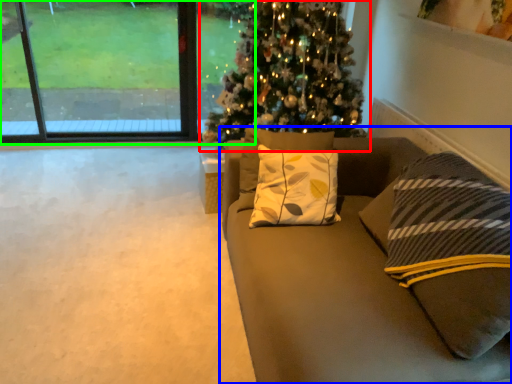
Question: Considering the real-world distances, which object is farthest from christmas tree (highlighted by a red box)? studio couch (highlighted by a blue box) or window (highlighted by a green box)?

Choices:
 (A) studio couch
 (B) window

Answer: (B)